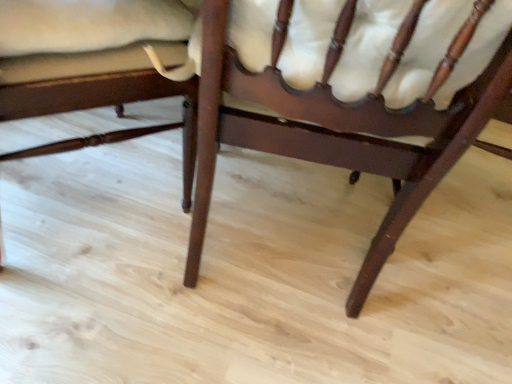
What do you see at coordinates (92, 64) in the screenshot? I see `matte dark wood chair at lower left, the second chair viewed from the right` at bounding box center [92, 64].

Measure the distance between matte dark wood chair at lower left, arranged as the 1th chair when viewed from the left, and camera.

The distance of matte dark wood chair at lower left, arranged as the 1th chair when viewed from the left, from camera is 24.11 inches.

Identify the location of matte dark wood chair at lower left, arranged as the 1th chair when viewed from the left. (92, 64).

Measure the distance between point (x=207, y=118) and camera.

Point (x=207, y=118) and camera are 25.43 inches apart from each other.

The height and width of the screenshot is (384, 512). In order to click on mahogany wood chair at center, arranged as the 1th chair when viewed from the right in this screenshot , I will do `click(334, 137)`.

What is the approximate height of mahogany wood chair at center, the second chair in the left-to-right sequence?

It is 28.72 inches.

This screenshot has width=512, height=384. Describe the element at coordinates (334, 137) in the screenshot. I see `mahogany wood chair at center, the second chair in the left-to-right sequence` at that location.

Where is `matte dark wood chair at lower left, arranged as the 1th chair when viewed from the left`? This screenshot has height=384, width=512. matte dark wood chair at lower left, arranged as the 1th chair when viewed from the left is located at coordinates (92, 64).

Which is more to the right, matte dark wood chair at lower left, arranged as the 1th chair when viewed from the left, or mahogany wood chair at center, arranged as the 1th chair when viewed from the right?

mahogany wood chair at center, arranged as the 1th chair when viewed from the right.

Consider the image. Is the position of matte dark wood chair at lower left, the second chair viewed from the right, less distant than that of mahogany wood chair at center, arranged as the 1th chair when viewed from the right?

No, it is behind mahogany wood chair at center, arranged as the 1th chair when viewed from the right.

Considering the positions of point (118, 16) and point (490, 115), is point (118, 16) closer or farther from the camera than point (490, 115)?

Point (118, 16).

From the image's perspective, relative to mahogany wood chair at center, the second chair in the left-to-right sequence, is matte dark wood chair at lower left, arranged as the 1th chair when viewed from the left, above or below?

Clearly, from the image's perspective, matte dark wood chair at lower left, arranged as the 1th chair when viewed from the left, is above mahogany wood chair at center, the second chair in the left-to-right sequence.

Based on the photo, from a real-world perspective, which is physically below, matte dark wood chair at lower left, the second chair viewed from the right, or mahogany wood chair at center, arranged as the 1th chair when viewed from the right?

In real-world perspective, matte dark wood chair at lower left, the second chair viewed from the right, is lower.

Does matte dark wood chair at lower left, the second chair viewed from the right, have a lesser width compared to mahogany wood chair at center, the second chair in the left-to-right sequence?

No, matte dark wood chair at lower left, the second chair viewed from the right, is not thinner than mahogany wood chair at center, the second chair in the left-to-right sequence.

Which of these two, matte dark wood chair at lower left, the second chair viewed from the right, or mahogany wood chair at center, arranged as the 1th chair when viewed from the right, stands taller?

With more height is mahogany wood chair at center, arranged as the 1th chair when viewed from the right.

Considering the sizes of objects matte dark wood chair at lower left, arranged as the 1th chair when viewed from the left, and mahogany wood chair at center, arranged as the 1th chair when viewed from the right, in the image provided, who is smaller, matte dark wood chair at lower left, arranged as the 1th chair when viewed from the left, or mahogany wood chair at center, arranged as the 1th chair when viewed from the right,?

mahogany wood chair at center, arranged as the 1th chair when viewed from the right.

Is matte dark wood chair at lower left, arranged as the 1th chair when viewed from the left, outside of mahogany wood chair at center, arranged as the 1th chair when viewed from the right?

Yes.

Are matte dark wood chair at lower left, the second chair viewed from the right, and mahogany wood chair at center, the second chair in the left-to-right sequence, far apart?

That's not correct — matte dark wood chair at lower left, the second chair viewed from the right, is a little close to mahogany wood chair at center, the second chair in the left-to-right sequence.

Is matte dark wood chair at lower left, the second chair viewed from the right, turned away from mahogany wood chair at center, arranged as the 1th chair when viewed from the right?

matte dark wood chair at lower left, the second chair viewed from the right, does not have its back to mahogany wood chair at center, arranged as the 1th chair when viewed from the right.

How many degrees apart are the facing directions of matte dark wood chair at lower left, arranged as the 1th chair when viewed from the left, and mahogany wood chair at center, arranged as the 1th chair when viewed from the right?

The angular difference between matte dark wood chair at lower left, arranged as the 1th chair when viewed from the left, and mahogany wood chair at center, arranged as the 1th chair when viewed from the right, is 36.1 degrees.

How much distance is there between matte dark wood chair at lower left, the second chair viewed from the right, and mahogany wood chair at center, arranged as the 1th chair when viewed from the right?

A distance of 9.70 inches exists between matte dark wood chair at lower left, the second chair viewed from the right, and mahogany wood chair at center, arranged as the 1th chair when viewed from the right.

Find the location of `chair that is below the matte dark wood chair at lower left, the second chair viewed from the right (from the image's perspective)`. chair that is below the matte dark wood chair at lower left, the second chair viewed from the right (from the image's perspective) is located at coordinates (334, 137).

Which object is positioned more to the right, mahogany wood chair at center, the second chair in the left-to-right sequence, or matte dark wood chair at lower left, the second chair viewed from the right?

mahogany wood chair at center, the second chair in the left-to-right sequence, is more to the right.

Consider the image. Considering the positions of objects mahogany wood chair at center, arranged as the 1th chair when viewed from the right, and matte dark wood chair at lower left, arranged as the 1th chair when viewed from the left, in the image provided, who is behind, mahogany wood chair at center, arranged as the 1th chair when viewed from the right, or matte dark wood chair at lower left, arranged as the 1th chair when viewed from the left,?

matte dark wood chair at lower left, arranged as the 1th chair when viewed from the left, is more distant.

Is point (403, 175) behind point (38, 48)?

Yes, it is behind point (38, 48).

From the image's perspective, is mahogany wood chair at center, arranged as the 1th chair when viewed from the right, beneath matte dark wood chair at lower left, the second chair viewed from the right?

Correct, mahogany wood chair at center, arranged as the 1th chair when viewed from the right, appears lower than matte dark wood chair at lower left, the second chair viewed from the right, in the image.

From a real-world perspective, is mahogany wood chair at center, arranged as the 1th chair when viewed from the right, physically located above or below matte dark wood chair at lower left, the second chair viewed from the right?

mahogany wood chair at center, arranged as the 1th chair when viewed from the right, is above matte dark wood chair at lower left, the second chair viewed from the right.

Which object is wider, mahogany wood chair at center, arranged as the 1th chair when viewed from the right, or matte dark wood chair at lower left, arranged as the 1th chair when viewed from the left?

matte dark wood chair at lower left, arranged as the 1th chair when viewed from the left.

Is mahogany wood chair at center, the second chair in the left-to-right sequence, shorter than matte dark wood chair at lower left, arranged as the 1th chair when viewed from the left?

Incorrect, the height of mahogany wood chair at center, the second chair in the left-to-right sequence, does not fall short of that of matte dark wood chair at lower left, arranged as the 1th chair when viewed from the left.

Between mahogany wood chair at center, arranged as the 1th chair when viewed from the right, and matte dark wood chair at lower left, the second chair viewed from the right, which one has larger size?

matte dark wood chair at lower left, the second chair viewed from the right.

Could matte dark wood chair at lower left, the second chair viewed from the right, be considered to be inside mahogany wood chair at center, the second chair in the left-to-right sequence?

No, matte dark wood chair at lower left, the second chair viewed from the right, is located outside of mahogany wood chair at center, the second chair in the left-to-right sequence.

Based on the photo, is mahogany wood chair at center, the second chair in the left-to-right sequence, with matte dark wood chair at lower left, the second chair viewed from the right?

No, mahogany wood chair at center, the second chair in the left-to-right sequence, is not in contact with matte dark wood chair at lower left, the second chair viewed from the right.

Could you tell me if mahogany wood chair at center, the second chair in the left-to-right sequence, is turned towards matte dark wood chair at lower left, the second chair viewed from the right?

No, mahogany wood chair at center, the second chair in the left-to-right sequence, is not oriented towards matte dark wood chair at lower left, the second chair viewed from the right.

How different are the orientations of mahogany wood chair at center, arranged as the 1th chair when viewed from the right, and matte dark wood chair at lower left, the second chair viewed from the right, in degrees?

They differ by 36.1 degrees in their facing directions.

Measure the distance from mahogany wood chair at center, the second chair in the left-to-right sequence, to matte dark wood chair at lower left, the second chair viewed from the right.

They are 9.70 inches apart.

The height and width of the screenshot is (384, 512). Identify the location of chair that is behind the mahogany wood chair at center, arranged as the 1th chair when viewed from the right. (92, 64).

In the image, there is a mahogany wood chair at center, arranged as the 1th chair when viewed from the right. Where is `chair below it (from a real-world perspective)`? This screenshot has height=384, width=512. chair below it (from a real-world perspective) is located at coordinates [92, 64].

I want to click on chair on the left of mahogany wood chair at center, the second chair in the left-to-right sequence, so click(92, 64).